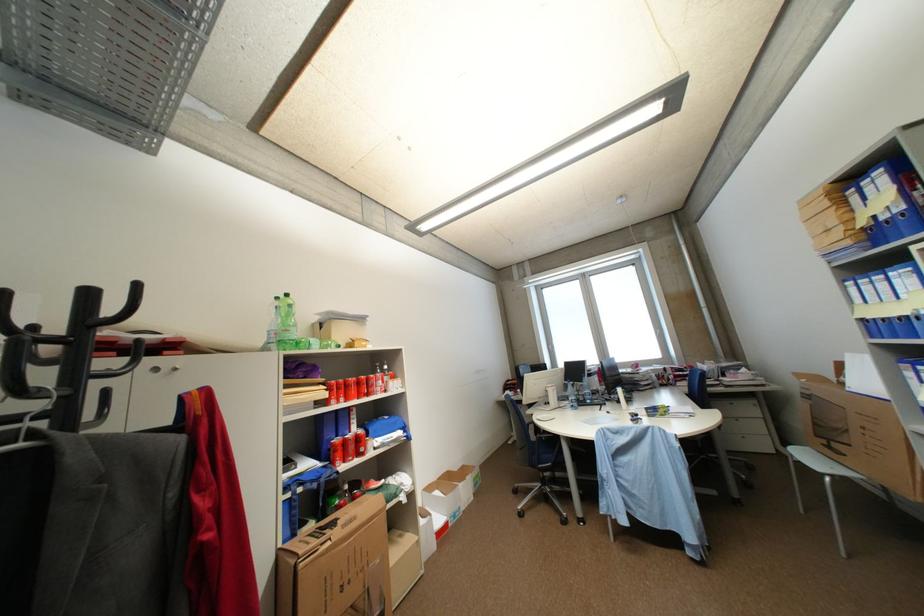
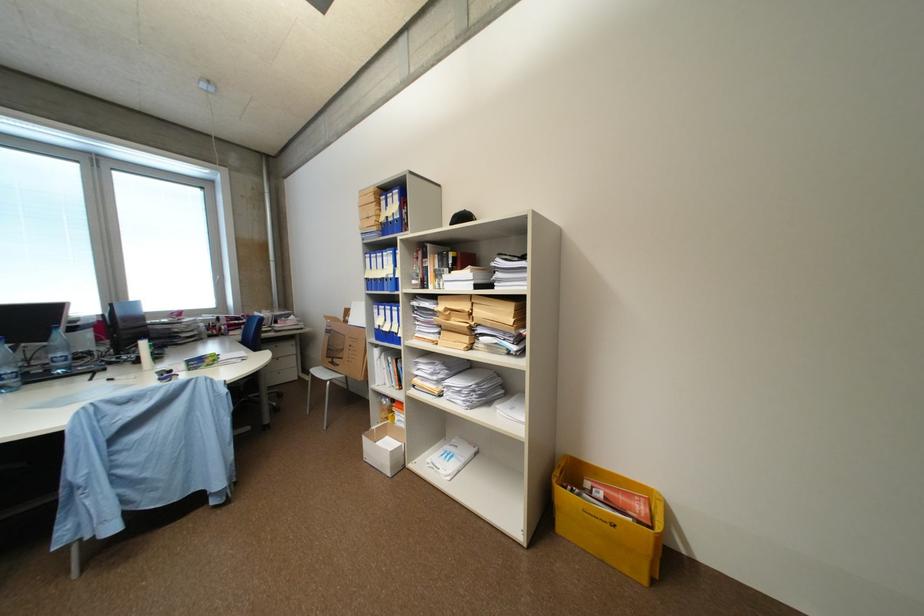
Where in the second image is the point corresponding to point (580, 408) from the first image?

(10, 389)